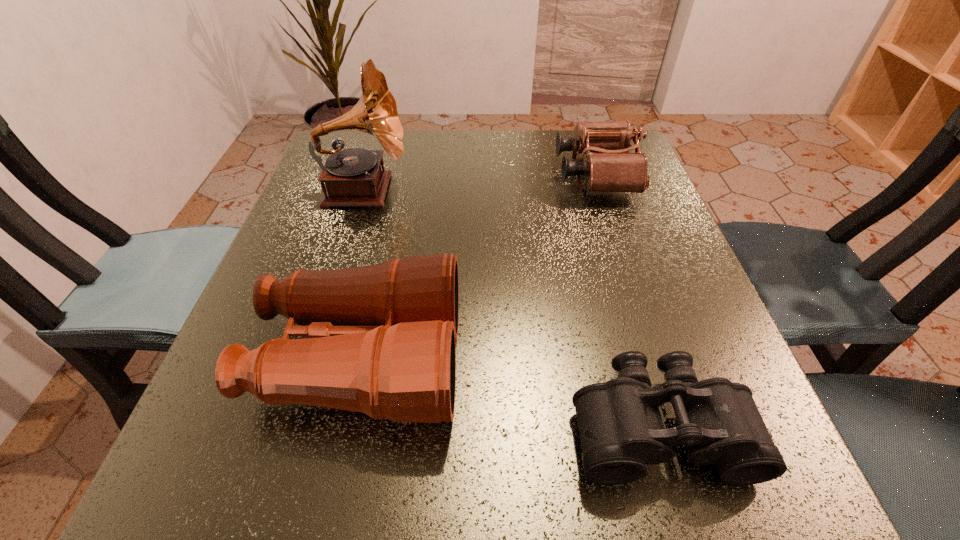
Find the location of a particular element. This screenshot has width=960, height=540. free space at the near edge of the desktop is located at coordinates (612, 513).

In the image, there is a desktop. Where is `vacant space at the left edge`? This screenshot has width=960, height=540. vacant space at the left edge is located at coordinates (330, 219).

Where is `free region at the right edge of the desktop`? The image size is (960, 540). free region at the right edge of the desktop is located at coordinates (716, 342).

Identify the location of vacant space at the far left corner of the desktop. (340, 134).

Find the location of a particular element. The height and width of the screenshot is (540, 960). free space at the near left corner of the desktop is located at coordinates (262, 456).

This screenshot has width=960, height=540. Find the location of `free space between the shortest binoculars and the tallest binoculars`. free space between the shortest binoculars and the tallest binoculars is located at coordinates (510, 393).

Where is `free space between the shortest object and the tallest binoculars`? free space between the shortest object and the tallest binoculars is located at coordinates (510, 393).

Locate an element on the screen. This screenshot has height=540, width=960. vacant space that's between the second shortest object and the phonograph_record is located at coordinates (480, 182).

Identify the location of vacant space in between the tallest object and the farthest binoculars. (480, 182).

What are the coordinates of `free area in between the third tallest object and the shortest object` in the screenshot? It's located at pos(627,300).